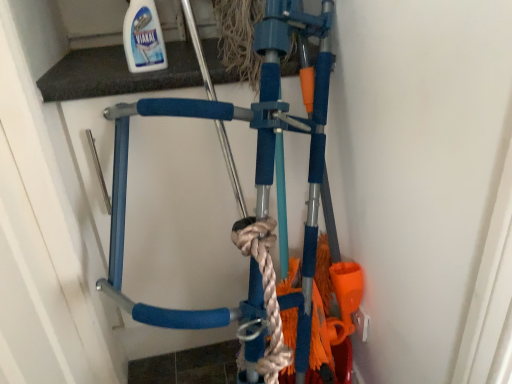
Question: Would you say white glossy bottle at upper center is inside or outside blue foam bicycle at center?

Choices:
 (A) inside
 (B) outside

Answer: (B)

Question: Would you say white glossy bottle at upper center is to the left or to the right of blue foam bicycle at center in the picture?

Choices:
 (A) left
 (B) right

Answer: (A)

Question: In terms of height, does white glossy bottle at upper center look taller or shorter compared to blue foam bicycle at center?

Choices:
 (A) tall
 (B) short

Answer: (B)

Question: Is blue foam bicycle at center wider or thinner than white glossy bottle at upper center?

Choices:
 (A) wide
 (B) thin

Answer: (A)

Question: In the image, is blue foam bicycle at center on the left side or the right side of white glossy bottle at upper center?

Choices:
 (A) right
 (B) left

Answer: (A)

Question: Is blue foam bicycle at center in front of or behind white glossy bottle at upper center in the image?

Choices:
 (A) front
 (B) behind

Answer: (B)

Question: From their relative heights in the image, would you say blue foam bicycle at center is taller or shorter than white glossy bottle at upper center?

Choices:
 (A) tall
 (B) short

Answer: (A)